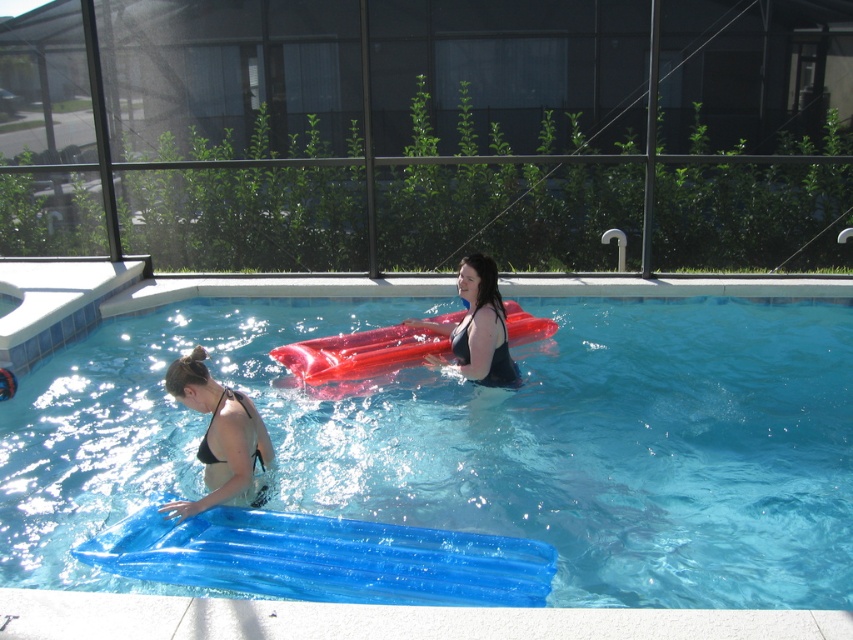
Question: Which point is closer to the camera?

Choices:
 (A) coord(218,451)
 (B) coord(22,388)
 (C) coord(397,358)
 (D) coord(506,339)

Answer: (A)

Question: Among these points, which one is farthest from the camera?

Choices:
 (A) (207, 308)
 (B) (250, 444)
 (C) (454, 346)
 (D) (389, 372)

Answer: (A)

Question: Is rubberized red raft at center further to camera compared to black matte bikini at lower left?

Choices:
 (A) yes
 (B) no

Answer: (A)

Question: Which of the following is the closest to the observer?

Choices:
 (A) (460, 352)
 (B) (328, 376)
 (C) (250, 428)

Answer: (C)

Question: Can you confirm if transparent blue float at center is bigger than matte black swimsuit at center?

Choices:
 (A) no
 (B) yes

Answer: (B)

Question: Can you confirm if transparent blue float at center is positioned below matte black swimsuit at center?

Choices:
 (A) no
 (B) yes

Answer: (B)